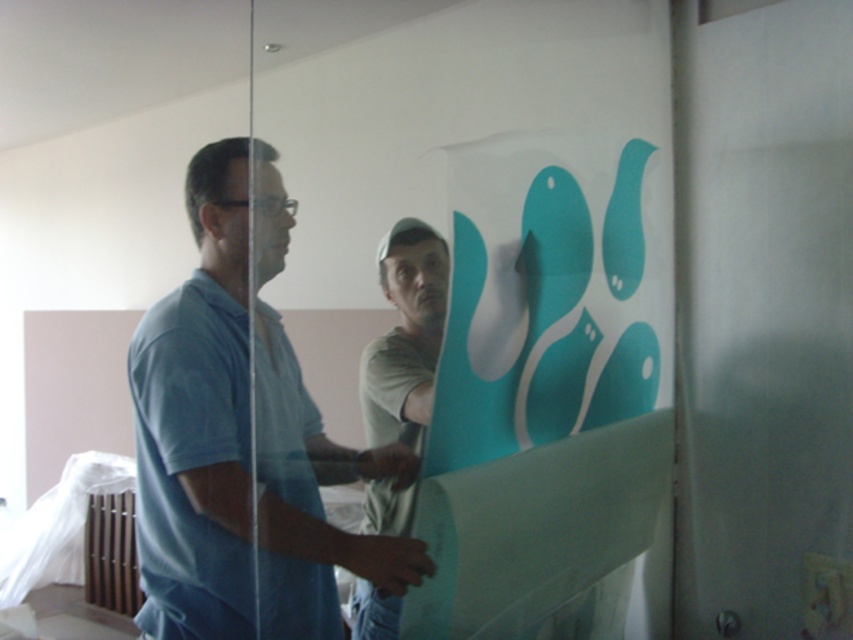
Can you confirm if blue cotton shirt at left is bigger than light brown paper at center?

Yes, blue cotton shirt at left is bigger than light brown paper at center.

Does blue cotton shirt at left have a greater height compared to light brown paper at center?

Yes.

What do you see at coordinates (242, 436) in the screenshot? The width and height of the screenshot is (853, 640). I see `blue cotton shirt at left` at bounding box center [242, 436].

Image resolution: width=853 pixels, height=640 pixels. Identify the location of blue cotton shirt at left. point(242,436).

Does transparent plastic glass door at center have a larger size compared to light brown paper at center?

Correct, transparent plastic glass door at center is larger in size than light brown paper at center.

Locate an element on the screen. This screenshot has height=640, width=853. transparent plastic glass door at center is located at coordinates (471, 164).

The width and height of the screenshot is (853, 640). In order to click on transparent plastic glass door at center in this screenshot , I will do `click(471, 164)`.

Is transparent plastic glass door at center below blue cotton shirt at left?

No.

Is point (323, 195) positioned after point (276, 554)?

Yes.

Find the location of `transparent plastic glass door at center`. transparent plastic glass door at center is located at coordinates (471, 164).